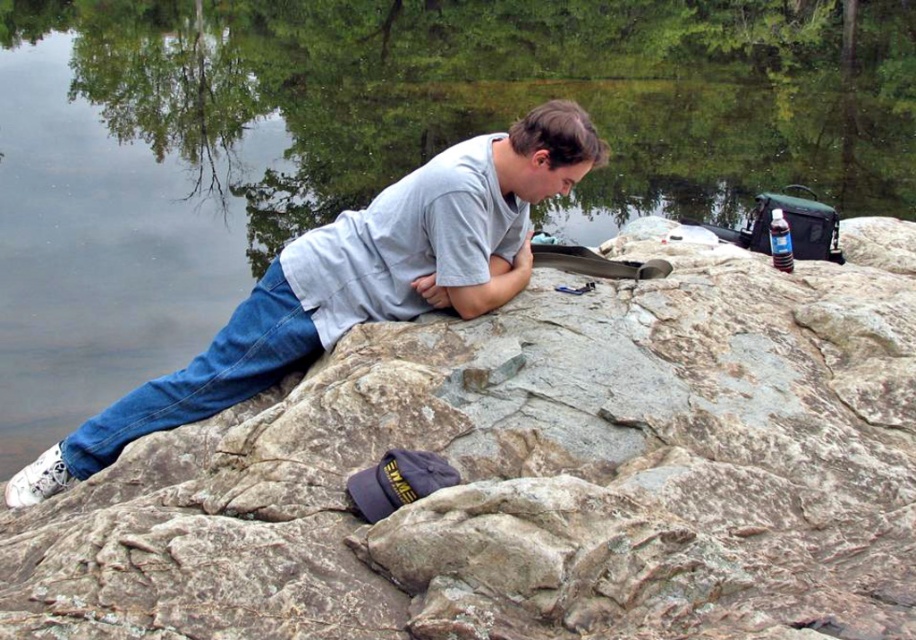
Question: Is the position of gray rough rock at center more distant than that of gray cotton shirt at center?

Choices:
 (A) no
 (B) yes

Answer: (A)

Question: Does gray rough rock at center appear over gray cotton shirt at center?

Choices:
 (A) yes
 (B) no

Answer: (B)

Question: Can you confirm if gray rough rock at center is positioned below gray cotton shirt at center?

Choices:
 (A) no
 (B) yes

Answer: (B)

Question: Which object is farther from the camera taking this photo?

Choices:
 (A) gray cotton shirt at center
 (B) gray rough rock at center

Answer: (A)

Question: Among these points, which one is nearest to the camera?

Choices:
 (A) (639, 314)
 (B) (463, 212)

Answer: (B)